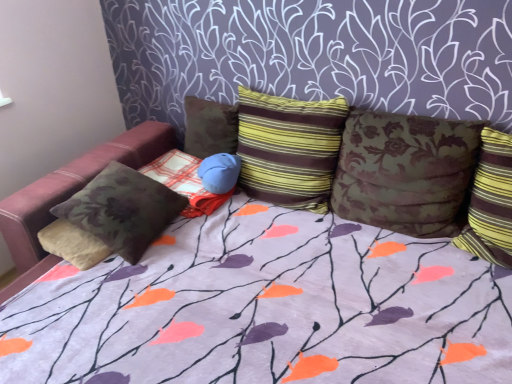
Question: From a real-world perspective, relative to brown floral pillow at center, which appears as the third pillow when viewed from the left, is striped fabric pillow at right, which is the 6th pillow from left to right, vertically above or below?

Choices:
 (A) above
 (B) below

Answer: (B)

Question: In terms of size, does striped fabric pillow at right, the first pillow viewed from the right, appear bigger or smaller than brown floral pillow at center, the 4th pillow from the right?

Choices:
 (A) small
 (B) big

Answer: (B)

Question: Which object is the closest to the brown floral pillow at center, the 4th pillow from the right?

Choices:
 (A) brown floral fabric bean bag chair at left
 (B) velvet floral pillow at left, placed as the first pillow when sorted from left to right
 (C) floral fabric pillow at center, marked as the second pillow in a right-to-left arrangement
 (D) yellow striped pillow at center, the 4th pillow in the left-to-right sequence
 (E) striped fabric pillow at right, which is the 6th pillow from left to right

Answer: (D)

Question: Based on their relative distances, which object is nearer to the striped fabric pillow at right, which is the 6th pillow from left to right?

Choices:
 (A) velvety brown pillow at center, acting as the second pillow starting from the left
 (B) brown floral fabric bean bag chair at left
 (C) velvet floral pillow at left, placed as the first pillow when sorted from left to right
 (D) brown floral pillow at center, the 4th pillow from the right
 (E) yellow striped pillow at center, the 4th pillow in the left-to-right sequence

Answer: (E)